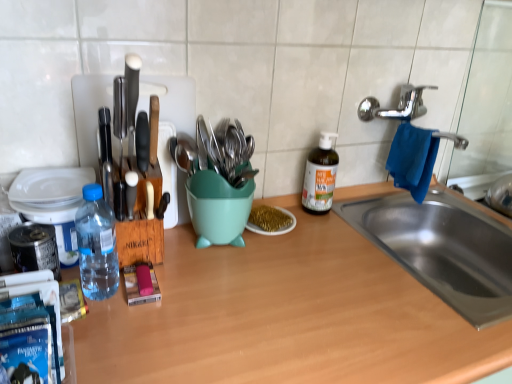
Describe the element at coordinates (53, 203) in the screenshot. I see `blue plastic water bottle at left` at that location.

Where is `wooden at center`? Image resolution: width=512 pixels, height=384 pixels. wooden at center is located at coordinates (285, 316).

What is the approximate width of white glossy plate at left?

4.06 inches.

The image size is (512, 384). Find the location of `white glossy plate at left`. white glossy plate at left is located at coordinates (50, 186).

Locate an element on the screen. metallic utensils at center is located at coordinates (217, 151).

The height and width of the screenshot is (384, 512). Identify the location of green glass bottle at center, marked as the first bottle in a right-to-left arrangement. (320, 176).

Considering the relative sizes of transparent plastic bottle at left, positioned as the first bottle in left-to-right order, and white glossy plate at left in the image provided, is transparent plastic bottle at left, positioned as the first bottle in left-to-right order, wider than white glossy plate at left?

In fact, transparent plastic bottle at left, positioned as the first bottle in left-to-right order, might be narrower than white glossy plate at left.

Can white glossy plate at left be found inside transparent plastic bottle at left, acting as the 1th bottle starting from the front?

Actually, white glossy plate at left is outside transparent plastic bottle at left, acting as the 1th bottle starting from the front.

Considering the sizes of objects transparent plastic bottle at left, positioned as the first bottle in left-to-right order, and white glossy plate at left in the image provided, who is shorter, transparent plastic bottle at left, positioned as the first bottle in left-to-right order, or white glossy plate at left?

Standing shorter between the two is white glossy plate at left.

Find the location of a particular element. This screenshot has width=512, height=384. tableware that appears on the left of green glass bottle at center, marked as the first bottle in a right-to-left arrangement is located at coordinates 217,151.

Who is taller, metallic utensils at center or green glass bottle at center, marked as the first bottle in a right-to-left arrangement?

With more height is green glass bottle at center, marked as the first bottle in a right-to-left arrangement.

From a real-world perspective, which object stands above the other?

In real-world perspective, metallic utensils at center is above.

Is green glass bottle at center, acting as the 2th bottle starting from the front, a part of metallic utensils at center?

No, green glass bottle at center, acting as the 2th bottle starting from the front, is not surrounded by metallic utensils at center.

At what (x,y) coordinates should I click in order to perform the action: click on plate above the blue plastic water bottle at left (from a real-world perspective). Please return your answer as a coordinate pair (x, y). Looking at the image, I should click on (50, 186).

From a real-world perspective, is white glossy plate at left physically located above or below blue plastic water bottle at left?

white glossy plate at left is above blue plastic water bottle at left.

Between white glossy plate at left and blue plastic water bottle at left, which one is positioned in front?

blue plastic water bottle at left is closer to the camera.

From the image's perspective, does white glossy plate at left appear lower than blue plastic water bottle at left?

No, from the image's perspective, white glossy plate at left is not beneath blue plastic water bottle at left.

Can you confirm if blue plastic water bottle at left is bigger than green glass bottle at center, acting as the 2th bottle starting from the front?

Yes.

Considering the sizes of objects blue plastic water bottle at left and green glass bottle at center, the first bottle when ordered from back to front, in the image provided, who is thinner, blue plastic water bottle at left or green glass bottle at center, the first bottle when ordered from back to front,?

green glass bottle at center, the first bottle when ordered from back to front, is thinner.

Is blue fabric hand towel at sink right taller or shorter than teal plastic mixing bowl at center?

Result: Clearly, blue fabric hand towel at sink right is taller compared to teal plastic mixing bowl at center.

Does blue fabric hand towel at sink right have a lesser width compared to teal plastic mixing bowl at center?

No.

Is blue fabric hand towel at sink right to the right of teal plastic mixing bowl at center from the viewer's perspective?

Indeed, blue fabric hand towel at sink right is positioned on the right side of teal plastic mixing bowl at center.

From the image's perspective, between teal plastic mixing bowl at center and transparent plastic bottle at left, which is counted as the 2th bottle, starting from the right, who is located below?

transparent plastic bottle at left, which is counted as the 2th bottle, starting from the right, appears lower in the image.

Is there a large distance between teal plastic mixing bowl at center and transparent plastic bottle at left, placed as the second bottle when sorted from back to front?

No.

Which object is closer to the camera, teal plastic mixing bowl at center or transparent plastic bottle at left, placed as the second bottle when sorted from back to front?

transparent plastic bottle at left, placed as the second bottle when sorted from back to front, is in front.

Does teal plastic mixing bowl at center appear on the right side of transparent plastic bottle at left, acting as the 1th bottle starting from the front?

Yes, teal plastic mixing bowl at center is to the right of transparent plastic bottle at left, acting as the 1th bottle starting from the front.

From the picture: Does transparent plastic bottle at left, positioned as the first bottle in left-to-right order, turn towards blue plastic water bottle at left?

No, transparent plastic bottle at left, positioned as the first bottle in left-to-right order, is not oriented towards blue plastic water bottle at left.

Can you tell me how much transparent plastic bottle at left, which is counted as the 2th bottle, starting from the right, and blue plastic water bottle at left differ in facing direction?

The angle between the facing direction of transparent plastic bottle at left, which is counted as the 2th bottle, starting from the right, and the facing direction of blue plastic water bottle at left is 3.26 degrees.

Is transparent plastic bottle at left, placed as the second bottle when sorted from back to front, placed right next to blue plastic water bottle at left?

Indeed, transparent plastic bottle at left, placed as the second bottle when sorted from back to front, and blue plastic water bottle at left are beside each other and touching.

Is transparent plastic bottle at left, positioned as the first bottle in left-to-right order, bigger or smaller than blue plastic water bottle at left?

In the image, transparent plastic bottle at left, positioned as the first bottle in left-to-right order, appears to be smaller than blue plastic water bottle at left.

The image size is (512, 384). Identify the location of plate above the transparent plastic bottle at left, placed as the second bottle when sorted from back to front (from the image's perspective). (50, 186).

Find the location of `tableware in front of the green glass bottle at center, the first bottle when ordered from back to front`. tableware in front of the green glass bottle at center, the first bottle when ordered from back to front is located at coordinates (217, 151).

Looking at the image, which one is located further to transparent plastic bottle at left, acting as the 1th bottle starting from the front, white glossy plate at left or green glass bottle at center, acting as the 2th bottle starting from the front?

green glass bottle at center, acting as the 2th bottle starting from the front, is positioned further to the anchor transparent plastic bottle at left, acting as the 1th bottle starting from the front.

From the image, which object appears to be nearer to green glass bottle at center, acting as the 2th bottle starting from the front, gold glitter plate at center or transparent plastic bottle at left, which is counted as the 2th bottle, starting from the right?

The object closer to green glass bottle at center, acting as the 2th bottle starting from the front, is gold glitter plate at center.

Estimate the real-world distances between objects in this image. Which object is further from green glass bottle at center, acting as the 2th bottle starting from the front, white glossy plate at left or blue plastic water bottle at left?

blue plastic water bottle at left is positioned further to the anchor green glass bottle at center, acting as the 2th bottle starting from the front.

Which object lies further to the anchor point metallic utensils at center, transparent plastic bottle at left, positioned as the first bottle in left-to-right order, or wooden at center?

Based on the image, wooden at center appears to be further to metallic utensils at center.

Estimate the real-world distances between objects in this image. Which object is closer to white glossy plate at left, transparent plastic bottle at left, positioned as the first bottle in left-to-right order, or green glass bottle at center, acting as the 2th bottle starting from the front?

transparent plastic bottle at left, positioned as the first bottle in left-to-right order, is positioned closer to the anchor white glossy plate at left.

Estimate the real-world distances between objects in this image. Which object is further from green glass bottle at center, marked as the first bottle in a right-to-left arrangement, metallic utensils at center or gold glitter plate at center?

metallic utensils at center is positioned further to the anchor green glass bottle at center, marked as the first bottle in a right-to-left arrangement.

Based on their spatial positions, is white glossy plate at left or wooden at center further from green glass bottle at center, the first bottle when ordered from back to front?

white glossy plate at left lies further to green glass bottle at center, the first bottle when ordered from back to front, than the other object.

Looking at the image, which one is located closer to metallic utensils at center, wooden at center or teal plastic mixing bowl at center?

The object closer to metallic utensils at center is teal plastic mixing bowl at center.

Where is `bottle between blue plastic water bottle at left and green glass bottle at center, acting as the 2th bottle starting from the front, from left to right`? bottle between blue plastic water bottle at left and green glass bottle at center, acting as the 2th bottle starting from the front, from left to right is located at coordinates (97, 245).

The image size is (512, 384). Find the location of `tableware between transparent plastic bottle at left, acting as the 1th bottle starting from the front, and green glass bottle at center, placed as the second bottle when sorted from left to right`. tableware between transparent plastic bottle at left, acting as the 1th bottle starting from the front, and green glass bottle at center, placed as the second bottle when sorted from left to right is located at coordinates (217, 151).

Where is `bottle between teal plastic mixing bowl at center and blue fabric hand towel at sink right`? bottle between teal plastic mixing bowl at center and blue fabric hand towel at sink right is located at coordinates (320, 176).

Find the location of a particular element. This screenshot has width=512, height=384. mixing bowl between wooden at center and gold glitter plate at center in the front-back direction is located at coordinates (218, 208).